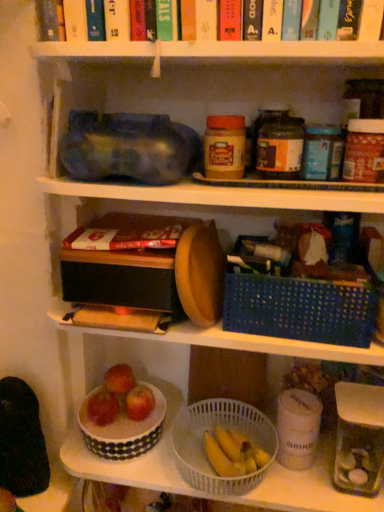
Where is `clear glass jar at lower right`? clear glass jar at lower right is located at coordinates (359, 439).

Image resolution: width=384 pixels, height=512 pixels. What do you see at coordinates (359, 439) in the screenshot?
I see `clear glass jar at lower right` at bounding box center [359, 439].

The width and height of the screenshot is (384, 512). What do you see at coordinates (139, 379) in the screenshot? I see `white polka dot bowl at lower center` at bounding box center [139, 379].

This screenshot has height=512, width=384. What do you see at coordinates (299, 308) in the screenshot? I see `blue plastic basket at center-right, the first basket positioned from the top` at bounding box center [299, 308].

Locate an element on the screen. This screenshot has height=512, width=384. white dotted bowl at lower left is located at coordinates (123, 428).

Is matte cardboard book at center shorter than shiny red apple at lower center, the 2th apple from the right?

Yes, matte cardboard book at center is shorter than shiny red apple at lower center, the 2th apple from the right.

Could shiny red apple at lower center, placed as the 2th apple when sorted from left to right, be considered to be inside matte cardboard book at center?

Actually, shiny red apple at lower center, placed as the 2th apple when sorted from left to right, is outside matte cardboard book at center.

Does matte cardboard book at center have a greater width compared to shiny red apple at lower center, the 2th apple from the right?

Correct, the width of matte cardboard book at center exceeds that of shiny red apple at lower center, the 2th apple from the right.

Can you confirm if matte cardboard book at center is positioned to the right of shiny red apple at lower center, the 2th apple from the right?

Yes, matte cardboard book at center is to the right of shiny red apple at lower center, the 2th apple from the right.

How different are the orientations of matte plastic peanut butter jar at center and white polka dot bowl at lower center in degrees?

They differ by 0.225 degrees in their facing directions.

Is matte plastic peanut butter jar at center facing towards white polka dot bowl at lower center?

No, matte plastic peanut butter jar at center does not turn towards white polka dot bowl at lower center.

Which object is further away from the camera taking this photo, matte plastic peanut butter jar at center or white polka dot bowl at lower center?

white polka dot bowl at lower center is more distant.

From a real-world perspective, is white polka dot bowl at lower center physically located above or below blue plastic basket at center-right, the second basket ordered from the bottom?

white polka dot bowl at lower center is situated lower than blue plastic basket at center-right, the second basket ordered from the bottom, in the real world.

From the image's perspective, who appears lower, white polka dot bowl at lower center or blue plastic basket at center-right, the second basket ordered from the bottom?

white polka dot bowl at lower center is shown below in the image.

Considering the relative sizes of white polka dot bowl at lower center and blue plastic basket at center-right, the second basket ordered from the bottom, in the image provided, is white polka dot bowl at lower center shorter than blue plastic basket at center-right, the second basket ordered from the bottom,?

Yes, white polka dot bowl at lower center is shorter than blue plastic basket at center-right, the second basket ordered from the bottom.

Could you tell me if white polka dot bowl at lower center is turned towards blue plastic basket at center-right, the second basket ordered from the bottom?

No, white polka dot bowl at lower center is not facing towards blue plastic basket at center-right, the second basket ordered from the bottom.

Considering the relative sizes of matte cardboard book at center and matte plastic peanut butter jar at center in the image provided, is matte cardboard book at center wider than matte plastic peanut butter jar at center?

Yes.

Considering the positions of objects matte cardboard book at center and matte plastic peanut butter jar at center in the image provided, who is more to the right, matte cardboard book at center or matte plastic peanut butter jar at center?

Positioned to the right is matte plastic peanut butter jar at center.

Is matte cardboard book at center positioned behind matte plastic peanut butter jar at center?

Yes.

Can you confirm if matte cardboard book at center is positioned to the right of clear glass jar at lower right?

In fact, matte cardboard book at center is to the left of clear glass jar at lower right.

Consider the image. Who is shorter, matte cardboard book at center or clear glass jar at lower right?

matte cardboard book at center.

Considering the sizes of objects matte cardboard book at center and clear glass jar at lower right in the image provided, who is bigger, matte cardboard book at center or clear glass jar at lower right?

Bigger between the two is clear glass jar at lower right.

In terms of size, does clear glass jar at lower right appear bigger or smaller than shiny red apple at lower center, the 2th apple from the right?

Clearly, clear glass jar at lower right is larger in size than shiny red apple at lower center, the 2th apple from the right.

Can you confirm if clear glass jar at lower right is shorter than shiny red apple at lower center, the 2th apple from the right?

No.

Is clear glass jar at lower right wider or thinner than shiny red apple at lower center, placed as the 2th apple when sorted from left to right?

Clearly, clear glass jar at lower right has more width compared to shiny red apple at lower center, placed as the 2th apple when sorted from left to right.

Is red matte apple at lower center, the first apple when ordered from left to right, far away from matte cardboard book at center?

That's not correct — red matte apple at lower center, the first apple when ordered from left to right, is a little close to matte cardboard book at center.

Does red matte apple at lower center, which is the third apple from right to left, have a greater height compared to matte cardboard book at center?

Correct, red matte apple at lower center, which is the third apple from right to left, is much taller as matte cardboard book at center.

Between red matte apple at lower center, which is the third apple from right to left, and matte cardboard book at center, which one has larger size?

matte cardboard book at center.

Where is `apple that is the 1st object directly below the matte cardboard book at center (from a real-world perspective)`? This screenshot has width=384, height=512. apple that is the 1st object directly below the matte cardboard book at center (from a real-world perspective) is located at coordinates (119, 379).

In order to click on shelf below the matte plastic peanut butter jar at center (from the image's perspective) in this screenshot , I will do `click(139, 379)`.

Looking at the image, which one is located closer to shiny red apple at lower center, the 2th apple from the right, red matte apple at lower center, the 1th apple positioned from the right, or blue plastic basket at center-right, the first basket positioned from the top?

red matte apple at lower center, the 1th apple positioned from the right, is positioned closer to the anchor shiny red apple at lower center, the 2th apple from the right.

Considering their positions, is matte cardboard book at center positioned closer to white dotted bowl at lower left than shiny red apple at lower center, the 2th apple from the right?

The object closer to white dotted bowl at lower left is shiny red apple at lower center, the 2th apple from the right.

Looking at this image, which object lies nearer to the anchor point matte cardboard book at center, red matte apple at lower center, the first apple when ordered from left to right, or white polka dot bowl at lower center?

white polka dot bowl at lower center.

Based on their spatial positions, is white dotted bowl at lower left or matte plastic peanut butter jar at center closer to white plastic basket at lower center, placed as the 2th basket when sorted from top to bottom?

white dotted bowl at lower left.

Which object lies further to the anchor point shiny red apple at lower center, the 2th apple from the right, matte cardboard book at center or white plastic basket at lower center, positioned as the first basket in bottom-to-top order?

Based on the image, matte cardboard book at center appears to be further to shiny red apple at lower center, the 2th apple from the right.

Considering their positions, is shiny red apple at lower center, the 2th apple from the right, positioned further to matte plastic peanut butter jar at center than red matte apple at lower center, which is the third apple from right to left?

red matte apple at lower center, which is the third apple from right to left, is positioned further to the anchor matte plastic peanut butter jar at center.

Estimate the real-world distances between objects in this image. Which object is closer to red matte apple at lower center, the 1th apple positioned from the right, red matte apple at lower center, which is the third apple from right to left, or matte cardboard book at center?

Among the two, red matte apple at lower center, which is the third apple from right to left, is located nearer to red matte apple at lower center, the 1th apple positioned from the right.

In the scene shown: Estimate the real-world distances between objects in this image. Which object is further from white polka dot bowl at lower center, white dotted bowl at lower left or shiny red apple at lower center, placed as the 2th apple when sorted from left to right?

The object further to white polka dot bowl at lower center is shiny red apple at lower center, placed as the 2th apple when sorted from left to right.

This screenshot has width=384, height=512. Find the location of `glass jar between matte plastic peanut butter jar at center and white dotted bowl at lower left in the up-down direction`. glass jar between matte plastic peanut butter jar at center and white dotted bowl at lower left in the up-down direction is located at coordinates (359, 439).

Find the location of a particular element. bowl situated between shiny red apple at lower center, placed as the 2th apple when sorted from left to right, and white polka dot bowl at lower center from left to right is located at coordinates (123, 428).

I want to click on shelf between white dotted bowl at lower left and clear glass jar at lower right from left to right, so click(139, 379).

Where is `shelf between shiny red apple at lower center, placed as the 2th apple when sorted from left to right, and clear glass jar at lower right`? The height and width of the screenshot is (512, 384). shelf between shiny red apple at lower center, placed as the 2th apple when sorted from left to right, and clear glass jar at lower right is located at coordinates (139, 379).